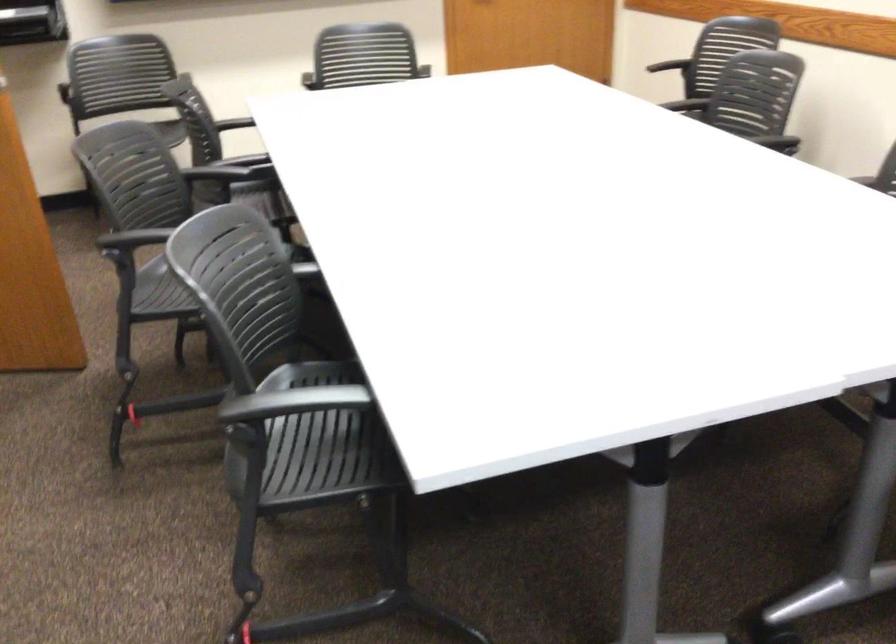
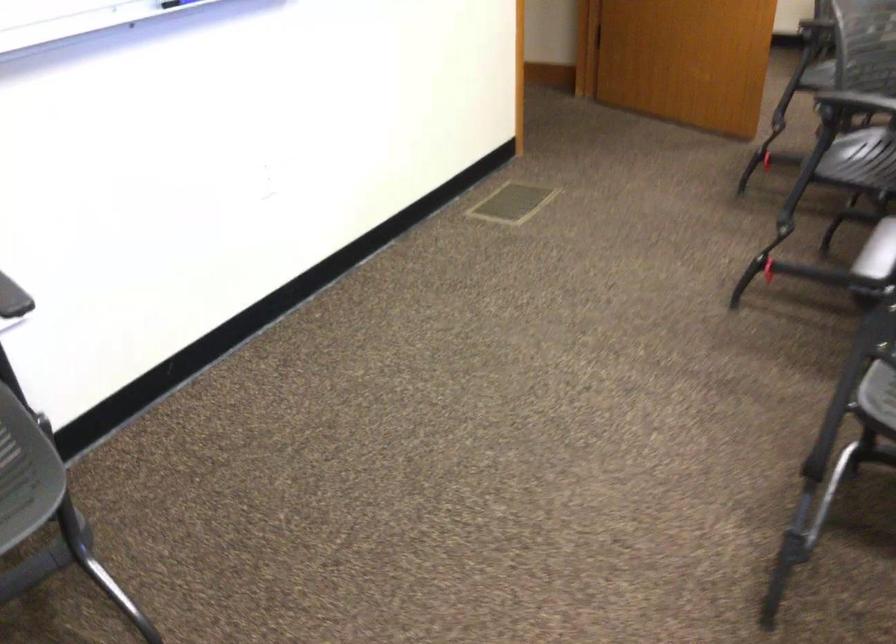
Locate, in the second image, the point that corresponds to [332,410] in the first image.

(857, 102)